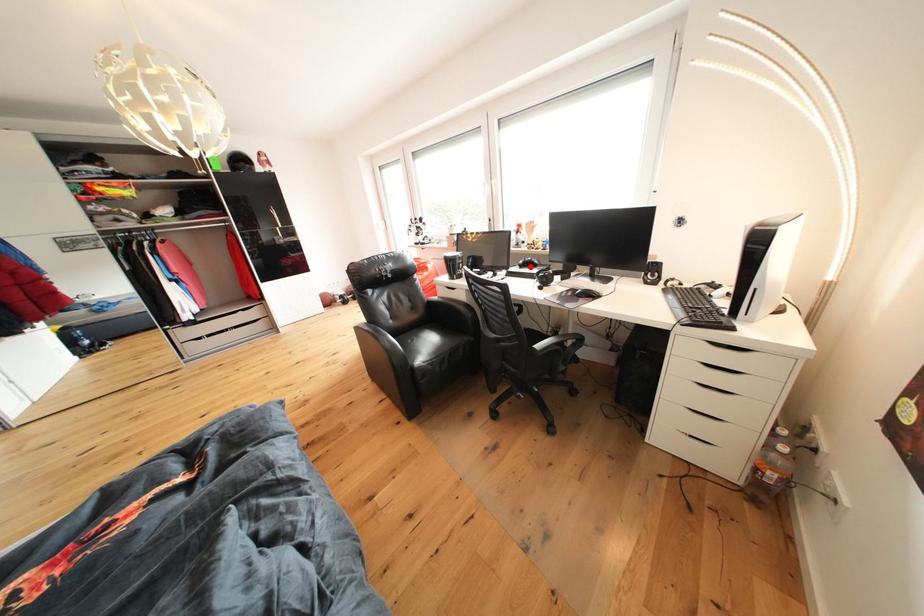
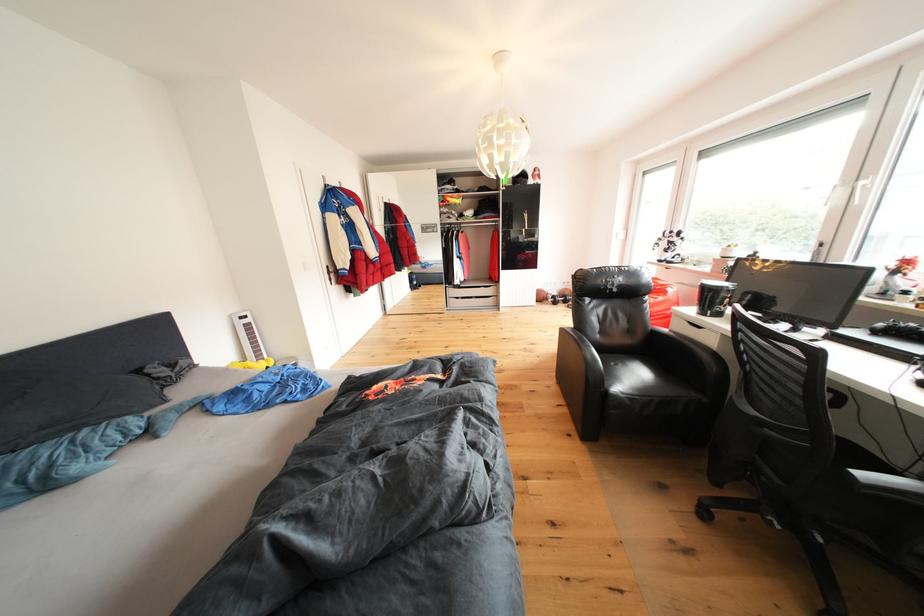
Question: I am providing you with two images of the same scene from different viewpoints. A red point is shown in image1. For the corresponding object point in image2, is it positioned nearer or farther from the camera?

Choices:
 (A) Nearer
 (B) Farther

Answer: (B)